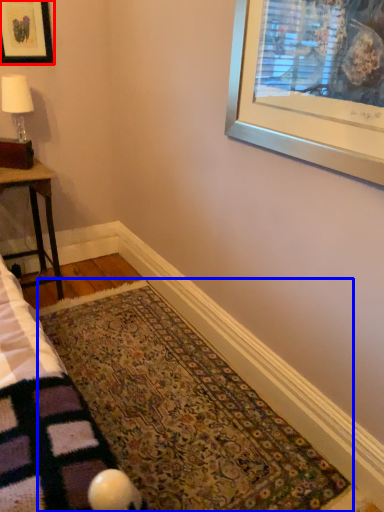
Question: Which object appears closest to the camera in this image, picture frame (highlighted by a red box) or mat (highlighted by a blue box)?

Choices:
 (A) picture frame
 (B) mat

Answer: (B)